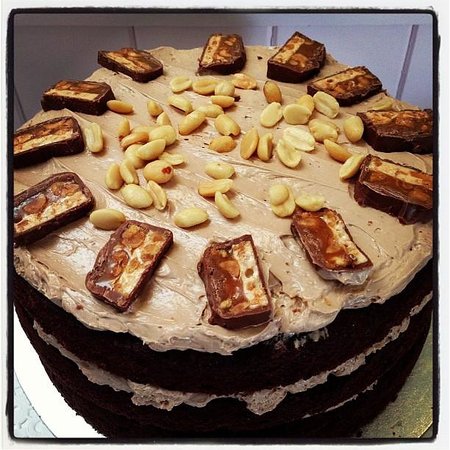
This screenshot has height=450, width=450. Find the location of `wall`. wall is located at coordinates (364, 47).